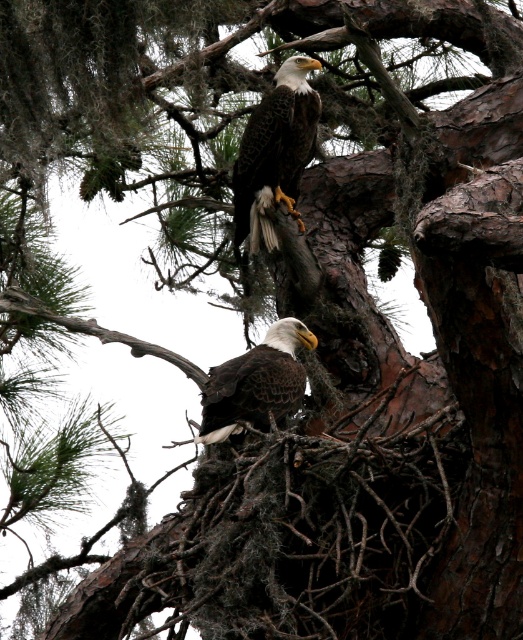
Who is taller, dark brown feathers at upper center or dark brown feathers at center?

dark brown feathers at upper center

Is dark brown feathers at upper center above dark brown feathers at center?

Yes.

Is point (302, 160) behind point (220, 433)?

Yes, point (302, 160) is behind point (220, 433).

In order to click on dark brown feathers at upper center in this screenshot , I will do `click(275, 152)`.